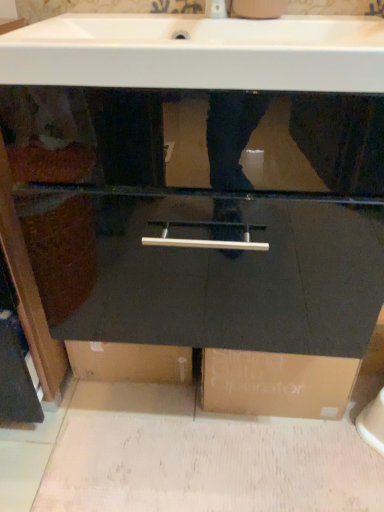
In order to click on white glossy sink at upper center in this screenshot , I will do `click(198, 53)`.

The width and height of the screenshot is (384, 512). What do you see at coordinates (198, 53) in the screenshot?
I see `white glossy sink at upper center` at bounding box center [198, 53].

Based on the photo, what is the approximate width of white glossy sink at upper center?

white glossy sink at upper center is 14.00 inches in width.

This screenshot has height=512, width=384. I want to click on white glossy sink at upper center, so click(x=198, y=53).